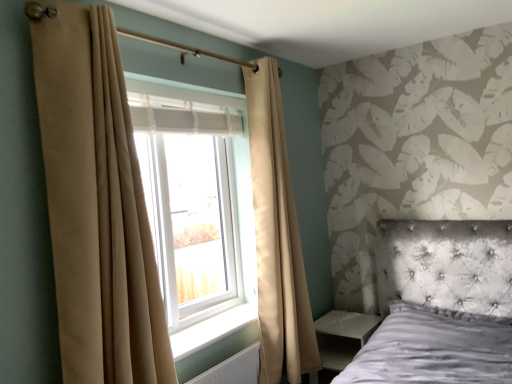
Question: Should I look upward or downward to see white textured radiator at lower center?

Choices:
 (A) down
 (B) up

Answer: (A)

Question: Is white plastic window at center positioned far away from white textured radiator at lower center?

Choices:
 (A) yes
 (B) no

Answer: (B)

Question: Is white plastic window at center to the right of white textured radiator at lower center from the viewer's perspective?

Choices:
 (A) no
 (B) yes

Answer: (A)

Question: Is white plastic window at center closer to the viewer compared to white textured radiator at lower center?

Choices:
 (A) yes
 (B) no

Answer: (B)

Question: Does white plastic window at center have a lesser width compared to white textured radiator at lower center?

Choices:
 (A) yes
 (B) no

Answer: (B)

Question: Can you confirm if white plastic window at center is positioned to the left of white textured radiator at lower center?

Choices:
 (A) yes
 (B) no

Answer: (A)

Question: Can you confirm if white plastic window at center is wider than white textured radiator at lower center?

Choices:
 (A) no
 (B) yes

Answer: (B)

Question: Is beige fabric curtain at left, which is the first curtain in back-to-front order, bigger than white glossy side table at lower right?

Choices:
 (A) yes
 (B) no

Answer: (A)

Question: From a real-world perspective, does beige fabric curtain at left, which ranks as the second curtain in left-to-right order, stand above white glossy side table at lower right?

Choices:
 (A) yes
 (B) no

Answer: (A)

Question: From the image's perspective, is beige fabric curtain at left, which is the first curtain from right to left, over white glossy side table at lower right?

Choices:
 (A) no
 (B) yes

Answer: (B)

Question: Is beige fabric curtain at left, which is the 2th curtain in front-to-back order, at the left side of white glossy side table at lower right?

Choices:
 (A) yes
 (B) no

Answer: (A)

Question: From a real-world perspective, is beige fabric curtain at left, which is the first curtain in back-to-front order, positioned under white glossy side table at lower right based on gravity?

Choices:
 (A) yes
 (B) no

Answer: (B)

Question: Is white glossy side table at lower right a part of beige fabric curtain at left, which is the first curtain from right to left?

Choices:
 (A) yes
 (B) no

Answer: (B)

Question: Is beige fabric curtain at left, which ranks as the second curtain in left-to-right order, to the right of white textured radiator at lower center from the viewer's perspective?

Choices:
 (A) no
 (B) yes

Answer: (B)